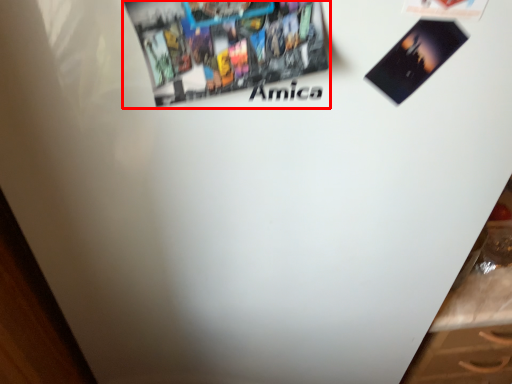
Question: In this image, where is poster (annotated by the red box) located relative to flyer?

Choices:
 (A) right
 (B) left

Answer: (B)